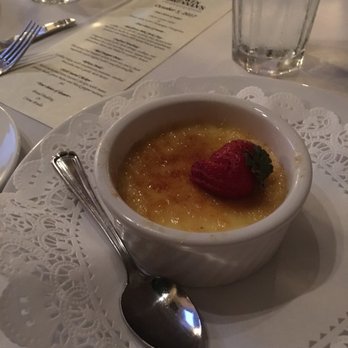
What are the coordinates of `handle` in the screenshot? It's located at (90, 201).